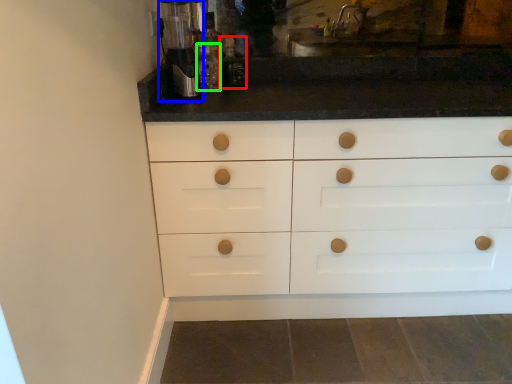
Question: Which is nearer to the bottle (highlighted by a red box)? coffee machine (highlighted by a blue box) or bottle (highlighted by a green box).

Choices:
 (A) coffee machine
 (B) bottle

Answer: (B)